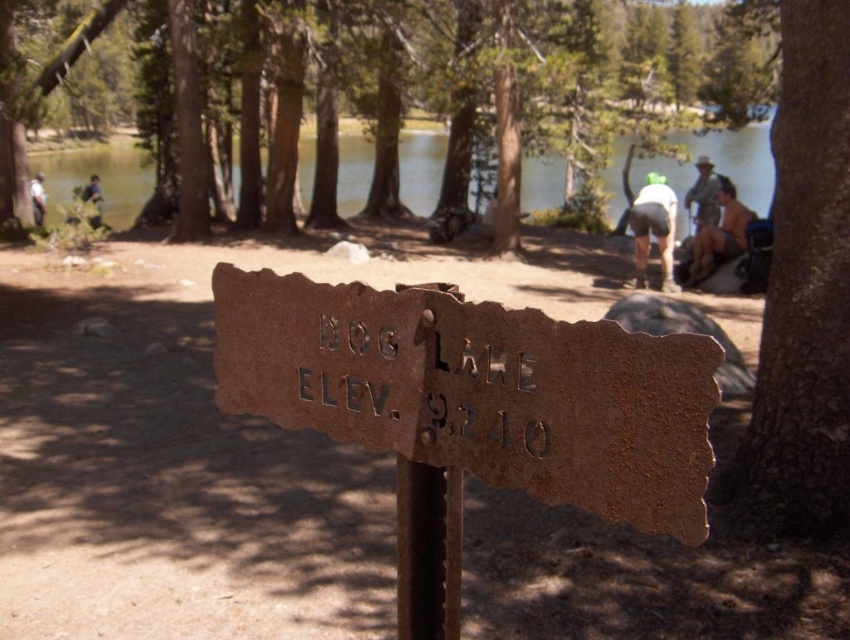
You are planning to take a photo of the clear water at lake center and the camouflage jacket at upper right. Which object should you focus on first if you want to capture both in a single frame without moving the camera?

The clear water at lake center is located above the camouflage jacket at upper right, so you should focus on the camouflage jacket at upper right first to ensure both are in the frame.

You are a hiker who wants to take a photo of the clear water at lake center and the camouflage jacket at upper right. Which object should you focus on first if you want both to be in sharp focus?

The clear water at lake center has a greater height compared to camouflage jacket at upper right, so you should focus on the clear water at lake center first to ensure both are in sharp focus.